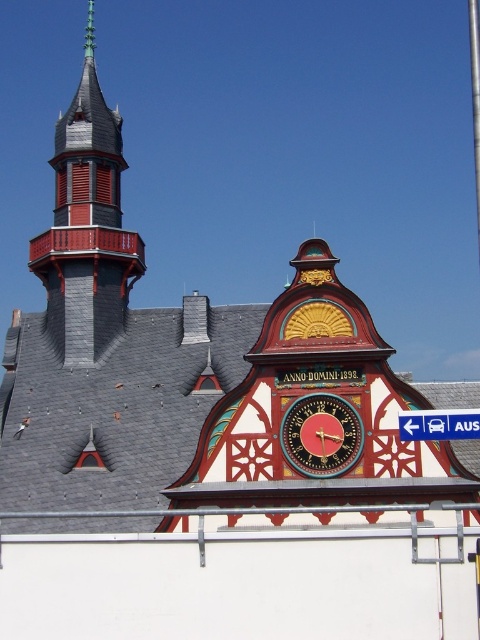
Is point (360, 422) closer to viewer compared to point (467, 420)?

No, it is behind (467, 420).

Does wooden clock face at center have a smaller size compared to blue plastic sign at upper right?

Yes, wooden clock face at center is smaller than blue plastic sign at upper right.

This screenshot has width=480, height=640. I want to click on wooden clock face at center, so click(x=322, y=435).